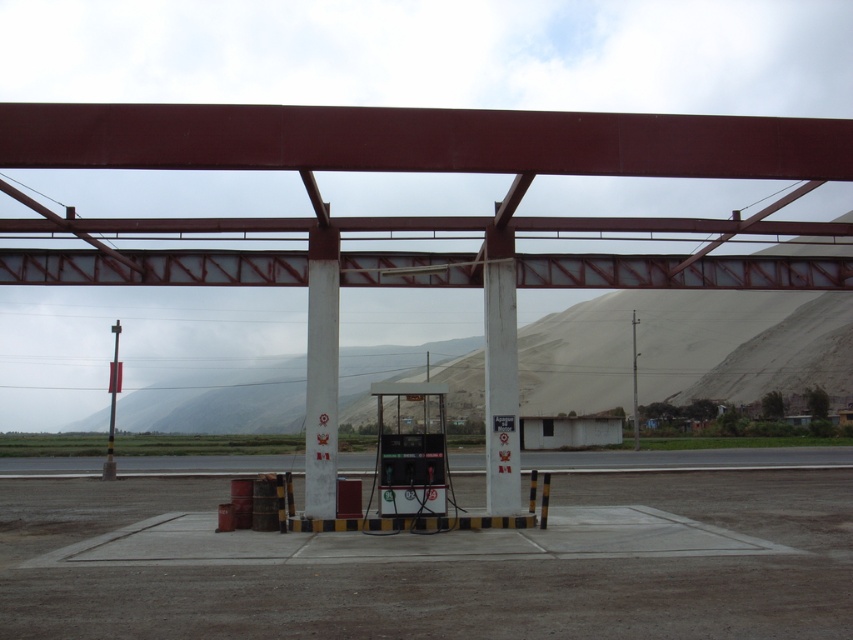
Question: Is white painted concrete pillar at center further to the viewer compared to metallic pole at center?

Choices:
 (A) no
 (B) yes

Answer: (A)

Question: Which of the following is the farthest from the observer?

Choices:
 (A) smooth red steel overpass at center
 (B) white painted concrete pillar at center
 (C) gray asphalt runway at lower center
 (D) metallic pole at center

Answer: (D)

Question: Which of the following is the farthest from the observer?

Choices:
 (A) white painted concrete pillar at center
 (B) metallic pole at left
 (C) metallic pole at center
 (D) gray asphalt runway at lower center

Answer: (C)

Question: Can you confirm if smooth red steel overpass at center is positioned above metallic pole at left?

Choices:
 (A) no
 (B) yes

Answer: (B)

Question: Can you confirm if smooth red steel overpass at center is positioned below gray asphalt runway at lower center?

Choices:
 (A) no
 (B) yes

Answer: (A)

Question: Among these points, which one is nearest to the camera?

Choices:
 (A) (225, 156)
 (B) (113, 422)
 (C) (514, 420)
 (D) (631, 396)

Answer: (A)